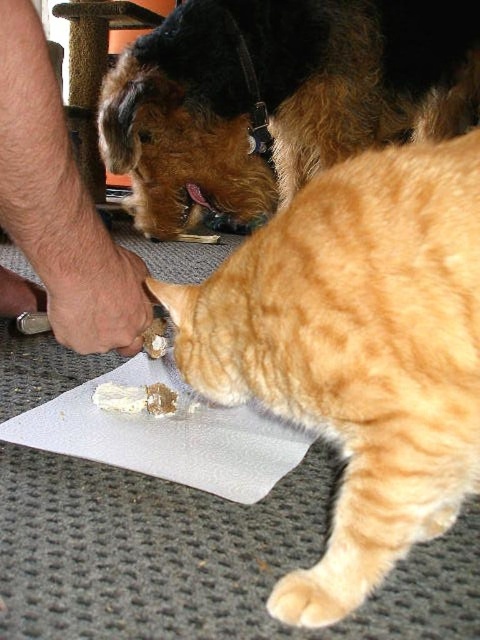
Can you confirm if orange fur cat at lower right is positioned to the left of brown fur dog at upper center?

Indeed, orange fur cat at lower right is positioned on the left side of brown fur dog at upper center.

Between orange fur cat at lower right and brown fur dog at upper center, which one has more height?

brown fur dog at upper center is taller.

This screenshot has width=480, height=640. In order to click on orange fur cat at lower right in this screenshot , I will do point(357,349).

Can you confirm if orange fur cat at lower right is taller than white creamy food at center?

Yes, orange fur cat at lower right is taller than white creamy food at center.

Which is in front, point (356, 552) or point (166, 408)?

Point (356, 552) is in front.

Find the location of `orange fur cat at lower right`. orange fur cat at lower right is located at coordinates (357, 349).

Can you confirm if brown fur dog at upper center is thinner than hair skin at lower left?

No, brown fur dog at upper center is not thinner than hair skin at lower left.

Does brown fur dog at upper center come in front of hair skin at lower left?

No, brown fur dog at upper center is behind hair skin at lower left.

You are a GUI agent. You are given a task and a screenshot of the screen. Output one action in this format:
    pyautogui.click(x=<x>, y=<y>)
    Task: Click on the brown fur dog at upper center
    This screenshot has width=480, height=640.
    Given the screenshot: What is the action you would take?
    pyautogui.click(x=278, y=99)

You are a GUI agent. You are given a task and a screenshot of the screen. Output one action in this format:
    pyautogui.click(x=<x>, y=<y>)
    Task: Click on the brown fur dog at upper center
    
    Given the screenshot: What is the action you would take?
    pyautogui.click(x=278, y=99)